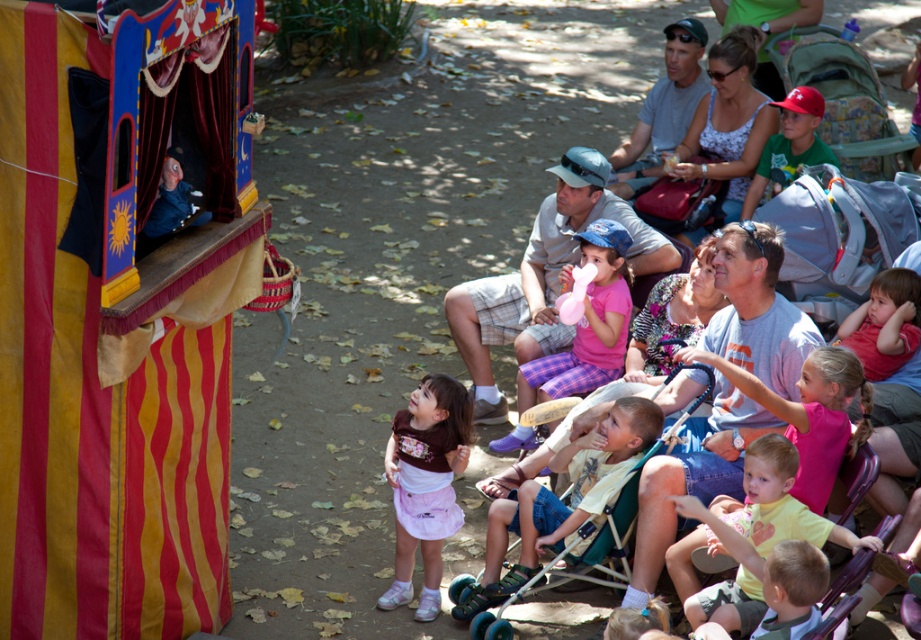
Which is in front, point (535, 264) or point (754, 544)?

Positioned in front is point (754, 544).

Who is lower down, pink fabric hat at center or yellow cotton shirt at lower right?

Positioned lower is yellow cotton shirt at lower right.

Locate an element on the screen. This screenshot has width=921, height=640. pink fabric hat at center is located at coordinates (543, 276).

Does light yellow sandal at lower center have a lesser width compared to pink fabric dress at center?

Incorrect, light yellow sandal at lower center's width is not less than pink fabric dress at center's.

You are a GUI agent. You are given a task and a screenshot of the screen. Output one action in this format:
    pyautogui.click(x=<x>, y=<y>)
    Task: Click on the light yellow sandal at lower center
    
    Given the screenshot: What is the action you would take?
    pyautogui.click(x=558, y=499)

The image size is (921, 640). What do you see at coordinates (756, 534) in the screenshot? I see `yellow cotton shirt at lower right` at bounding box center [756, 534].

This screenshot has width=921, height=640. What are the coordinates of `yellow cotton shirt at lower right` in the screenshot? It's located at (756, 534).